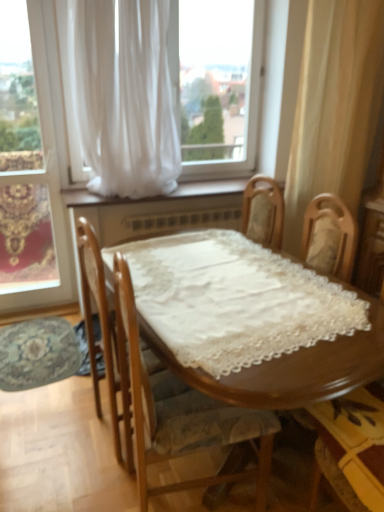
What do you see at coordinates (161, 391) in the screenshot? I see `wooden chair with lace cushion at center, which is the 2th chair from right to left` at bounding box center [161, 391].

At what (x,y) coordinates should I click in order to perform the action: click on wooden chair with lace cushion at center, which ranks as the first chair in left-to-right order. Please return your answer as a coordinate pair (x, y). The width and height of the screenshot is (384, 512). Looking at the image, I should click on (161, 391).

Image resolution: width=384 pixels, height=512 pixels. What do you see at coordinates (31, 166) in the screenshot? I see `white sheer curtain at left, positioned as the second window in right-to-left order` at bounding box center [31, 166].

I want to click on white sheer curtain at upper center, which is the second window in left-to-right order, so click(x=62, y=94).

At what (x,y) coordinates should I click in order to perform the action: click on wooden chair at lower right, the 2th chair positioned from the left. Please return your answer as a coordinate pair (x, y). Looking at the image, I should click on (356, 441).

Where is `the 1st chair below when counting from the white sheer curtain at right, which is the 1th curtain from right to left (from the image's perspective)`? The width and height of the screenshot is (384, 512). the 1st chair below when counting from the white sheer curtain at right, which is the 1th curtain from right to left (from the image's perspective) is located at coordinates (161, 391).

Is white sheer curtain at right, which is counted as the second curtain, starting from the left, next to wooden chair with lace cushion at center, which ranks as the first chair in left-to-right order, and touching it?

white sheer curtain at right, which is counted as the second curtain, starting from the left, and wooden chair with lace cushion at center, which ranks as the first chair in left-to-right order, are clearly separated.

Does white sheer curtain at left, positioned as the second window in right-to-left order, have a lesser height compared to white sheer curtain at right, which is counted as the second curtain, starting from the left?

Incorrect, the height of white sheer curtain at left, positioned as the second window in right-to-left order, does not fall short of that of white sheer curtain at right, which is counted as the second curtain, starting from the left.

Which curtain is the 2nd one when counting from the right side of the white sheer curtain at left, positioned as the second window in right-to-left order? Please provide its 2D coordinates.

[(334, 106)]

In the image, is white sheer curtain at left, positioned as the second window in right-to-left order, positioned in front of or behind white sheer curtain at right, which is counted as the second curtain, starting from the left?

In the image, white sheer curtain at left, positioned as the second window in right-to-left order, appears in front of white sheer curtain at right, which is counted as the second curtain, starting from the left.

From a real-world perspective, is white sheer curtain at left, positioned as the second window in right-to-left order, on top of white sheer curtain at right, which is the 1th curtain from right to left?

No.

In the scene shown: Who is taller, white sheer curtain at upper center, which is the second window in left-to-right order, or white sheer curtain at upper center, which appears as the first curtain when viewed from the left?

With more height is white sheer curtain at upper center, which is the second window in left-to-right order.

Could you measure the distance between white sheer curtain at upper center, which appears as the 1th window when viewed from the right, and white sheer curtain at upper center, the 2th curtain positioned from the right?

A distance of 16.47 inches exists between white sheer curtain at upper center, which appears as the 1th window when viewed from the right, and white sheer curtain at upper center, the 2th curtain positioned from the right.

Find the location of `curtain that is in front of the white sheer curtain at upper center, which is the second window in left-to-right order`. curtain that is in front of the white sheer curtain at upper center, which is the second window in left-to-right order is located at coordinates (124, 96).

Does white sheer curtain at upper center, which appears as the 1th window when viewed from the right, touch white sheer curtain at upper center, which appears as the first curtain when viewed from the left?

No, white sheer curtain at upper center, which appears as the 1th window when viewed from the right, is not in contact with white sheer curtain at upper center, which appears as the first curtain when viewed from the left.

Can you tell me how much wooden chair at lower right, arranged as the 1th chair when viewed from the right, and white sheer curtain at upper center, the 2th curtain positioned from the right, differ in facing direction?

The facing directions of wooden chair at lower right, arranged as the 1th chair when viewed from the right, and white sheer curtain at upper center, the 2th curtain positioned from the right, are 3.2 degrees apart.

From a real-world perspective, relative to white sheer curtain at upper center, the 2th curtain positioned from the right, is wooden chair at lower right, the 2th chair positioned from the left, vertically above or below?

From a real-world perspective, wooden chair at lower right, the 2th chair positioned from the left, is physically below white sheer curtain at upper center, the 2th curtain positioned from the right.

You are a GUI agent. You are given a task and a screenshot of the screen. Output one action in this format:
    pyautogui.click(x=<x>, y=<y>)
    Task: Click on the 1st chair in front of the white sheer curtain at upper center, which appears as the first curtain when viewed from the left
    The width and height of the screenshot is (384, 512).
    Given the screenshot: What is the action you would take?
    pyautogui.click(x=356, y=441)

Is wooden chair at lower right, the 2th chair positioned from the left, turned away from white sheer curtain at upper center, which appears as the first curtain when viewed from the left?

No.

From the image's perspective, is white sheer curtain at left, positioned as the second window in right-to-left order, under white sheer curtain at upper center, which is the second window in left-to-right order?

Yes.

Does point (48, 220) appear closer or farther from the camera than point (65, 68)?

Point (48, 220).

How many degrees apart are the facing directions of white sheer curtain at left, placed as the first window when sorted from left to right, and white sheer curtain at upper center, which appears as the 1th window when viewed from the right?

There is a 1.03-degree angle between the facing directions of white sheer curtain at left, placed as the first window when sorted from left to right, and white sheer curtain at upper center, which appears as the 1th window when viewed from the right.

Is white sheer curtain at left, positioned as the second window in right-to-left order, not inside white sheer curtain at upper center, which appears as the 1th window when viewed from the right?

Yes, white sheer curtain at left, positioned as the second window in right-to-left order, is not within white sheer curtain at upper center, which appears as the 1th window when viewed from the right.

Visually, is white sheer curtain at upper center, which appears as the first curtain when viewed from the left, positioned to the left or to the right of white sheer curtain at upper center, which is the second window in left-to-right order?

In the image, white sheer curtain at upper center, which appears as the first curtain when viewed from the left, appears on the left side of white sheer curtain at upper center, which is the second window in left-to-right order.

From the image's perspective, is white sheer curtain at upper center, which appears as the first curtain when viewed from the left, beneath white sheer curtain at upper center, which appears as the 1th window when viewed from the right?

Indeed, from the image's perspective, white sheer curtain at upper center, which appears as the first curtain when viewed from the left, is shown beneath white sheer curtain at upper center, which appears as the 1th window when viewed from the right.

How different are the orientations of white sheer curtain at upper center, which appears as the first curtain when viewed from the left, and white sheer curtain at upper center, which appears as the 1th window when viewed from the right, in degrees?

They differ by 0.469 degrees in their facing directions.

Is white sheer curtain at upper center, the 2th curtain positioned from the right, taller or shorter than white sheer curtain at upper center, which is the second window in left-to-right order?

Clearly, white sheer curtain at upper center, the 2th curtain positioned from the right, is shorter compared to white sheer curtain at upper center, which is the second window in left-to-right order.

Is wooden chair with lace cushion at center, which ranks as the first chair in left-to-right order, outside of white sheer curtain at upper center, which is the second window in left-to-right order?

That's correct, wooden chair with lace cushion at center, which ranks as the first chair in left-to-right order, is outside of white sheer curtain at upper center, which is the second window in left-to-right order.

Which of these two, wooden chair with lace cushion at center, which ranks as the first chair in left-to-right order, or white sheer curtain at upper center, which is the second window in left-to-right order, stands shorter?

wooden chair with lace cushion at center, which ranks as the first chair in left-to-right order.

Is wooden chair with lace cushion at center, which ranks as the first chair in left-to-right order, far from white sheer curtain at upper center, which is the second window in left-to-right order?

Yes, wooden chair with lace cushion at center, which ranks as the first chair in left-to-right order, and white sheer curtain at upper center, which is the second window in left-to-right order, are located far from each other.

This screenshot has width=384, height=512. Identify the location of the 2nd chair in front of the white sheer curtain at upper center, which is the second window in left-to-right order, counting from the anchor's position. (161, 391).

There is a wooden chair with lace cushion at center, which is the 2th chair from right to left. Find the location of `the 1st curtain above it (from a real-world perspective)`. the 1st curtain above it (from a real-world perspective) is located at coordinates (334, 106).

Identify the location of window that is the 2nd object to the left of the white sheer curtain at right, which is the 1th curtain from right to left, starting at the anchor. (31, 166).

Estimate the real-world distances between objects in this image. Which object is further from wooden chair with lace cushion at center, which is the 2th chair from right to left, white sheer curtain at upper center, which appears as the 1th window when viewed from the right, or white sheer curtain at left, positioned as the second window in right-to-left order?

white sheer curtain at upper center, which appears as the 1th window when viewed from the right, lies further to wooden chair with lace cushion at center, which is the 2th chair from right to left, than the other object.

Based on the photo, which object lies nearer to the anchor point white sheer curtain at upper center, the 2th curtain positioned from the right, white sheer curtain at right, which is the 1th curtain from right to left, or white sheer curtain at left, positioned as the second window in right-to-left order?

white sheer curtain at left, positioned as the second window in right-to-left order.

Based on the photo, from the image, which object appears to be nearer to white sheer curtain at upper center, which appears as the first curtain when viewed from the left, wooden chair at lower right, the 2th chair positioned from the left, or white sheer curtain at right, which is the 1th curtain from right to left?

Based on the image, white sheer curtain at right, which is the 1th curtain from right to left, appears to be nearer to white sheer curtain at upper center, which appears as the first curtain when viewed from the left.

From the image, which object appears to be nearer to wooden chair with lace cushion at center, which is the 2th chair from right to left, white sheer curtain at left, placed as the first window when sorted from left to right, or white sheer curtain at upper center, which is the second window in left-to-right order?

white sheer curtain at left, placed as the first window when sorted from left to right, lies closer to wooden chair with lace cushion at center, which is the 2th chair from right to left, than the other object.

Based on their spatial positions, is white sheer curtain at upper center, which appears as the 1th window when viewed from the right, or wooden chair with lace cushion at center, which ranks as the first chair in left-to-right order, closer to wooden chair at lower right, the 2th chair positioned from the left?

wooden chair with lace cushion at center, which ranks as the first chair in left-to-right order.

Considering their positions, is white sheer curtain at right, which is the 1th curtain from right to left, positioned closer to wooden chair at lower right, arranged as the 1th chair when viewed from the right, than white sheer curtain at left, placed as the first window when sorted from left to right?

white sheer curtain at right, which is the 1th curtain from right to left, lies closer to wooden chair at lower right, arranged as the 1th chair when viewed from the right, than the other object.

From the image, which object appears to be farther from wooden chair with lace cushion at center, which ranks as the first chair in left-to-right order, white sheer curtain at right, which is the 1th curtain from right to left, or white sheer curtain at left, placed as the first window when sorted from left to right?

Based on the image, white sheer curtain at right, which is the 1th curtain from right to left, appears to be further to wooden chair with lace cushion at center, which ranks as the first chair in left-to-right order.

Which object lies further to the anchor point white sheer curtain at right, which is the 1th curtain from right to left, wooden chair at lower right, arranged as the 1th chair when viewed from the right, or white sheer curtain at upper center, which appears as the first curtain when viewed from the left?

wooden chair at lower right, arranged as the 1th chair when viewed from the right.

You are a GUI agent. You are given a task and a screenshot of the screen. Output one action in this format:
    pyautogui.click(x=<x>, y=<y>)
    Task: Click on the window located between white sheer curtain at upper center, the 2th curtain positioned from the right, and white sheer curtain at right, which is counted as the second curtain, starting from the left, in the left-right direction
    This screenshot has width=384, height=512.
    Given the screenshot: What is the action you would take?
    pyautogui.click(x=62, y=94)

Image resolution: width=384 pixels, height=512 pixels. What are the coordinates of `chair between white sheer curtain at upper center, which appears as the 1th window when viewed from the right, and wooden chair at lower right, arranged as the 1th chair when viewed from the right, vertically` in the screenshot? It's located at (161, 391).

Where is `curtain between white sheer curtain at upper center, the 2th curtain positioned from the right, and wooden chair with lace cushion at center, which ranks as the first chair in left-to-right order, from top to bottom`? The height and width of the screenshot is (512, 384). curtain between white sheer curtain at upper center, the 2th curtain positioned from the right, and wooden chair with lace cushion at center, which ranks as the first chair in left-to-right order, from top to bottom is located at coordinates (334, 106).

Locate an element on the screen. curtain between white sheer curtain at upper center, which appears as the first curtain when viewed from the left, and wooden chair at lower right, the 2th chair positioned from the left, vertically is located at coordinates (334, 106).